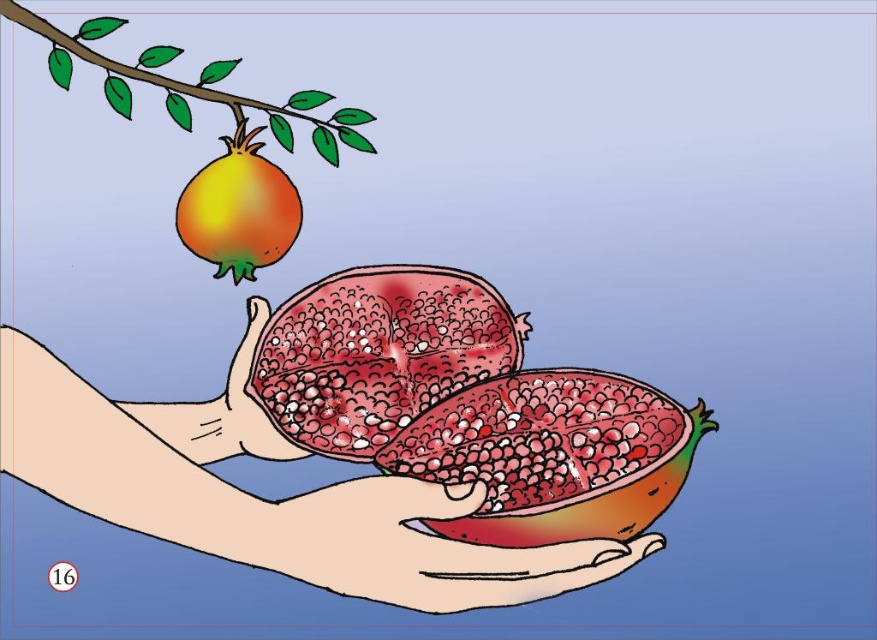
You are trying to decide which object takes up more horizontal space in the image. Based on the scene, which one is wider between the smooth red pomegranate halves at center and the smooth red pomegranate at center?

The smooth red pomegranate halves at center might be wider than smooth red pomegranate at center according to the description.

Looking at this image, you are an artist who wants to paint the distance between the two pomegranates in the image. The smooth red pomegranate halves at center and the smooth red pomegranate at center are part of the same fruit. How far apart are they?

The smooth red pomegranate halves at center and the smooth red pomegranate at center are 3.36 centimeters apart from each other.